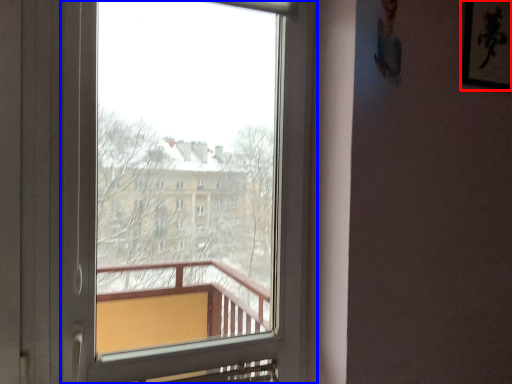
Question: Which of the following is the closest to the observer, picture frame (highlighted by a red box) or window (highlighted by a blue box)?

Choices:
 (A) picture frame
 (B) window

Answer: (B)